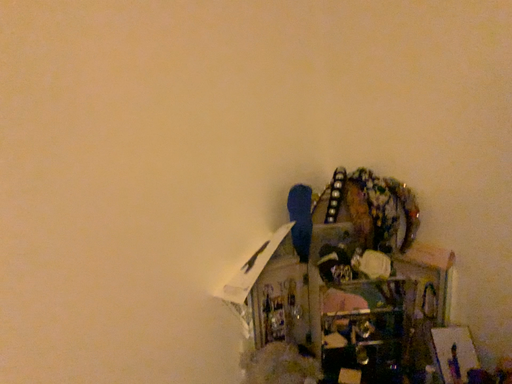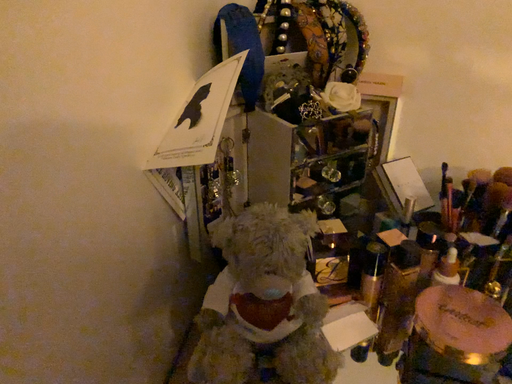
Question: How did the camera likely rotate when shooting the video?

Choices:
 (A) rotated downward
 (B) rotated upward

Answer: (A)